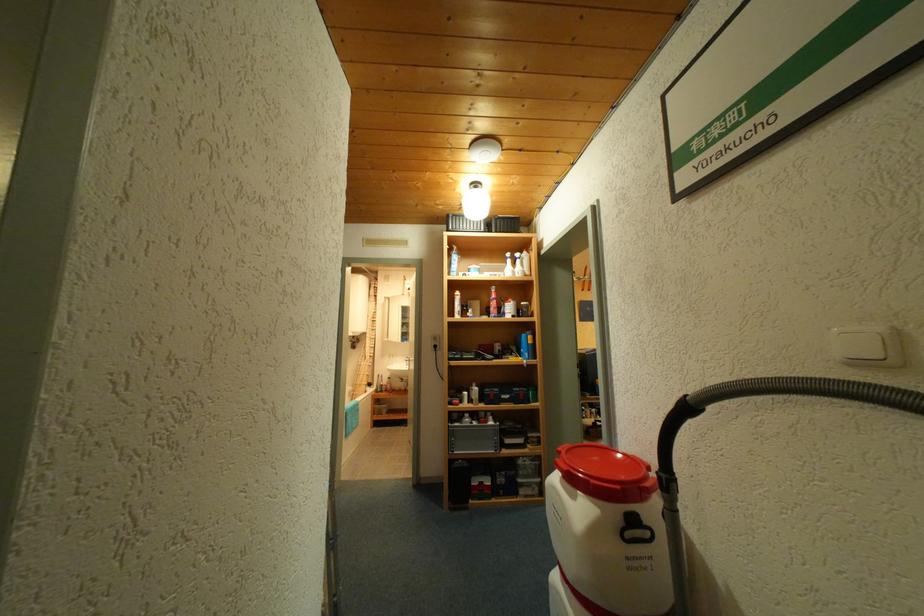
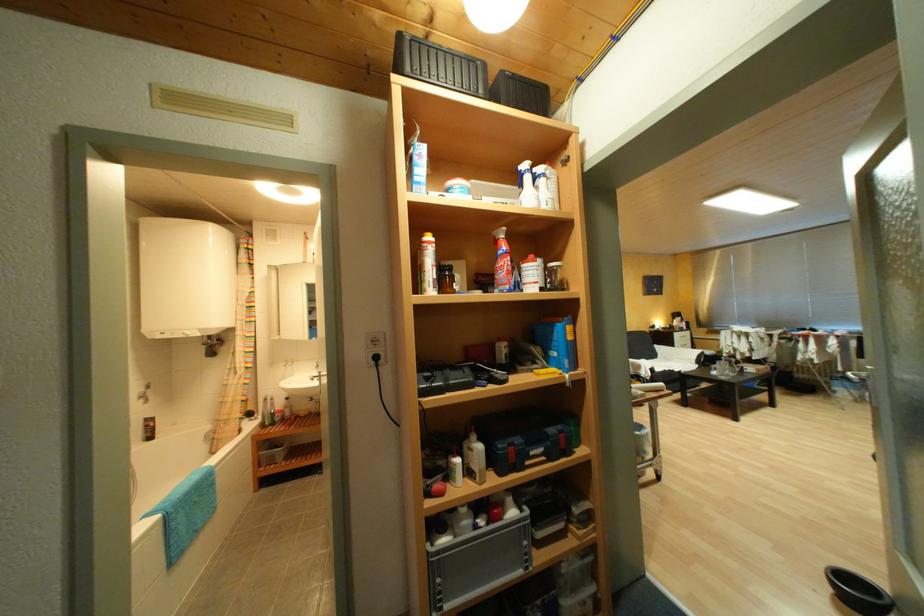
In the second image, find the point that corresponds to point (512, 398) in the first image.

(541, 454)